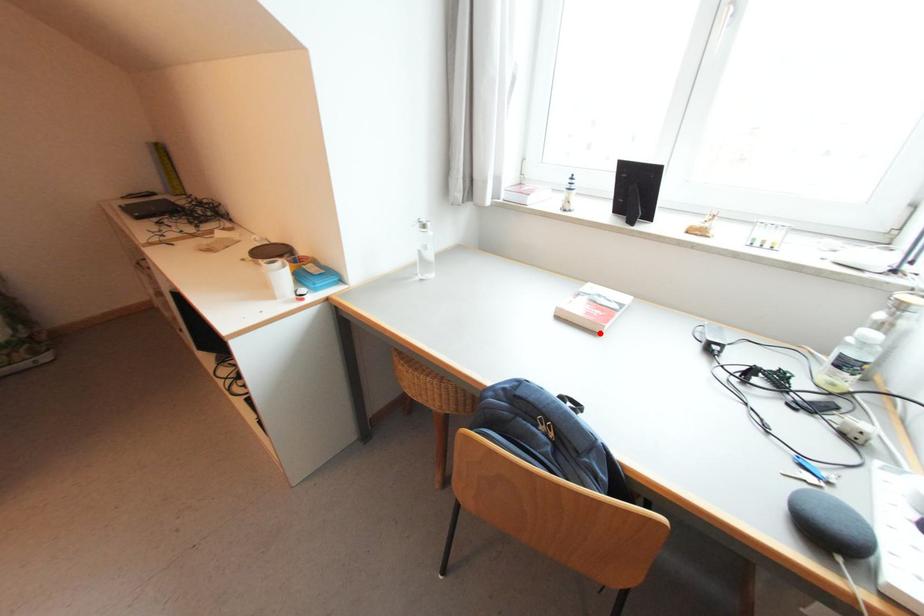
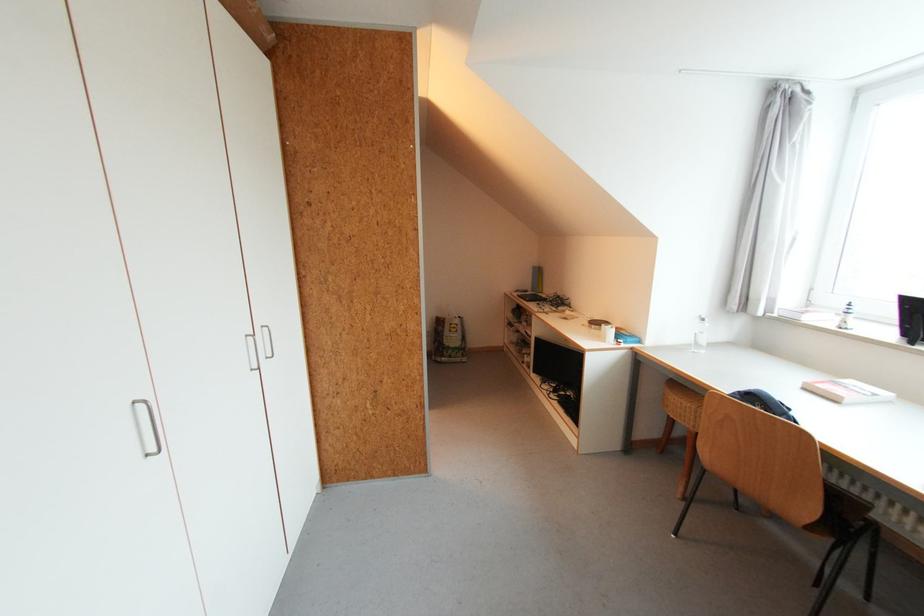
Find the pixel in the second image that matches the highlighted location in the first image.

(841, 403)